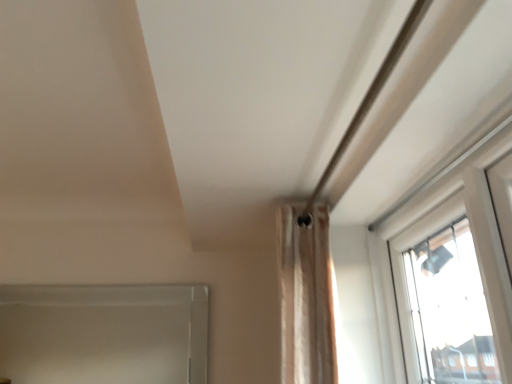
Question: Relative to clear glass window frame at lower left, is beige fabric curtain at center in front or behind?

Choices:
 (A) behind
 (B) front

Answer: (B)

Question: Is beige fabric curtain at center wider or thinner than clear glass window frame at lower left?

Choices:
 (A) thin
 (B) wide

Answer: (B)

Question: Is beige fabric curtain at center taller or shorter than clear glass window frame at lower left?

Choices:
 (A) short
 (B) tall

Answer: (B)

Question: Considering the positions of point (70, 296) and point (322, 266), is point (70, 296) closer or farther from the camera than point (322, 266)?

Choices:
 (A) farther
 (B) closer

Answer: (A)

Question: Is clear glass window frame at lower left in front of or behind beige fabric curtain at center in the image?

Choices:
 (A) front
 (B) behind

Answer: (B)

Question: In the image, is clear glass window frame at lower left on the left side or the right side of beige fabric curtain at center?

Choices:
 (A) right
 (B) left

Answer: (B)

Question: Looking at the image, does clear glass window frame at lower left seem bigger or smaller compared to beige fabric curtain at center?

Choices:
 (A) big
 (B) small

Answer: (B)